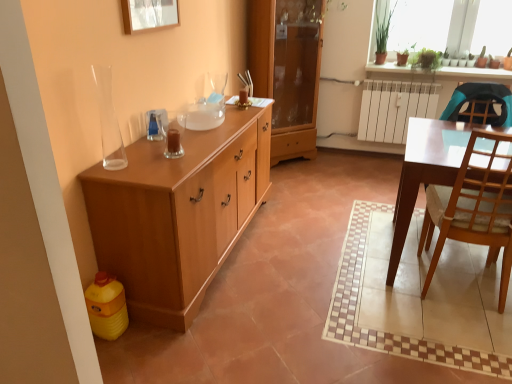
What do you see at coordinates (473, 208) in the screenshot? I see `light brown wooden chair at right` at bounding box center [473, 208].

I want to click on wooden cabinet at center, the 2th cabinetry in the front-to-back sequence, so click(287, 70).

Describe the element at coordinates (382, 30) in the screenshot. I see `green leafy plant at upper right, which appears as the 2th houseplant when viewed from the right` at that location.

Image resolution: width=512 pixels, height=384 pixels. In order to click on transparent glass vase at upper left in this screenshot , I will do `click(108, 120)`.

Which object is wider, green glass vase at upper right or wooden cabinet at center, the 2th cabinetry in the front-to-back sequence?

wooden cabinet at center, the 2th cabinetry in the front-to-back sequence, is wider.

Identify the location of the 1st cabinetry in front of the green glass vase at upper right. (287, 70).

From the image's perspective, who appears lower, green glass vase at upper right or wooden cabinet at center, the 2th cabinetry in the front-to-back sequence?

wooden cabinet at center, the 2th cabinetry in the front-to-back sequence, appears lower in the image.

Is the surface of light brown wooden chair at right in direct contact with light brown wood cabinet at left, positioned as the 2th cabinetry in back-to-front order?

They are not placed beside each other.

From a real-world perspective, is light brown wooden chair at right beneath light brown wood cabinet at left, positioned as the 2th cabinetry in back-to-front order?

No.

Consider the image. Is light brown wooden chair at right positioned with its back to light brown wood cabinet at left, positioned as the 2th cabinetry in back-to-front order?

No.

Is light brown wooden chair at right wider or thinner than light brown wood cabinet at left, which is the first cabinetry in front-to-back order?

Considering their sizes, light brown wooden chair at right looks broader than light brown wood cabinet at left, which is the first cabinetry in front-to-back order.

The width and height of the screenshot is (512, 384). Identify the location of counter top above the light brown wood cabinet at left, which is the first cabinetry in front-to-back order (from a real-world perspective). (473, 73).

Measure the distance from green glass vase at upper right to light brown wood cabinet at left, which is the first cabinetry in front-to-back order.

7.83 feet.

Visually, is green glass vase at upper right positioned to the left or to the right of light brown wood cabinet at left, which is the first cabinetry in front-to-back order?

green glass vase at upper right is to the right of light brown wood cabinet at left, which is the first cabinetry in front-to-back order.

Does green glass vase at upper right have a smaller size compared to light brown wood cabinet at left, which is the first cabinetry in front-to-back order?

Indeed, green glass vase at upper right has a smaller size compared to light brown wood cabinet at left, which is the first cabinetry in front-to-back order.

Is green leafy plant at upper right, which appears as the 2th houseplant when viewed from the right, thinner than light brown wood cabinet at left, which is the first cabinetry in front-to-back order?

Correct, the width of green leafy plant at upper right, which appears as the 2th houseplant when viewed from the right, is less than that of light brown wood cabinet at left, which is the first cabinetry in front-to-back order.

Are green leafy plant at upper right, the first houseplant when ordered from left to right, and light brown wood cabinet at left, positioned as the 2th cabinetry in back-to-front order, far apart?

That's right, there is a large distance between green leafy plant at upper right, the first houseplant when ordered from left to right, and light brown wood cabinet at left, positioned as the 2th cabinetry in back-to-front order.

Is green leafy plant at upper right, which appears as the 2th houseplant when viewed from the right, turned away from light brown wood cabinet at left, which is the first cabinetry in front-to-back order?

green leafy plant at upper right, which appears as the 2th houseplant when viewed from the right, is not turned away from light brown wood cabinet at left, which is the first cabinetry in front-to-back order.

From the image's perspective, who appears lower, light brown wood cabinet at left, positioned as the 2th cabinetry in back-to-front order, or green leafy plants at upper right?

light brown wood cabinet at left, positioned as the 2th cabinetry in back-to-front order, appears lower in the image.

Is light brown wood cabinet at left, which is the first cabinetry in front-to-back order, next to green leafy plants at upper right?

No, light brown wood cabinet at left, which is the first cabinetry in front-to-back order, is not in contact with green leafy plants at upper right.

Which is in front, point (158, 212) or point (379, 13)?

The point (158, 212) is closer to the camera.

From a real-world perspective, is transparent glass vase at upper left under green matte plant at upper right, the 1th houseplant from the right?

No, from a real-world perspective, transparent glass vase at upper left is not beneath green matte plant at upper right, the 1th houseplant from the right.

Is transparent glass vase at upper left outside of green matte plant at upper right, the 1th houseplant from the right?

Absolutely, transparent glass vase at upper left is external to green matte plant at upper right, the 1th houseplant from the right.

Between transparent glass vase at upper left and green matte plant at upper right, the 1th houseplant from the right, which one appears on the right side from the viewer's perspective?

green matte plant at upper right, the 1th houseplant from the right, is more to the right.

Based on the photo, is transparent glass vase at upper left turned away from green matte plant at upper right, the 1th houseplant from the right?

transparent glass vase at upper left does not have its back to green matte plant at upper right, the 1th houseplant from the right.

Where is `window screen above the green glass vase at upper right (from the image's perspective)`? window screen above the green glass vase at upper right (from the image's perspective) is located at coordinates (450, 25).

Which is more to the right, green glass vase at upper right or green leafy plants at upper right?

green leafy plants at upper right.

How different are the orientations of green glass vase at upper right and green leafy plants at upper right in degrees?

The angle between the facing direction of green glass vase at upper right and the facing direction of green leafy plants at upper right is 0.000216 degrees.

Which object is closer to the camera, green glass vase at upper right or green leafy plants at upper right?

green leafy plants at upper right is in front.

Where is `counter top lying above the wooden cabinet at center, positioned as the 1th cabinetry in back-to-front order (from the image's perspective)`? Image resolution: width=512 pixels, height=384 pixels. counter top lying above the wooden cabinet at center, positioned as the 1th cabinetry in back-to-front order (from the image's perspective) is located at coordinates (473, 73).

This screenshot has height=384, width=512. In the image, there is a light brown wooden chair at right. Find the location of `cabinetry below it (from a real-world perspective)`. cabinetry below it (from a real-world perspective) is located at coordinates (177, 213).

When comparing their distances from transparent glass sink at center, does green glass vase at upper right or green leafy plant at upper right, which appears as the 2th houseplant when viewed from the right, seem further?

green glass vase at upper right lies further to transparent glass sink at center than the other object.

When comparing their distances from green leafy plants at upper right, does green matte plant at upper right, positioned as the second houseplant in left-to-right order, or green glass vase at upper right seem closer?

green matte plant at upper right, positioned as the second houseplant in left-to-right order, is positioned closer to the anchor green leafy plants at upper right.

Estimate the real-world distances between objects in this image. Which object is further from light brown wood cabinet at left, positioned as the 2th cabinetry in back-to-front order, green leafy plants at upper right or transparent glass vase at upper left?

green leafy plants at upper right.

Estimate the real-world distances between objects in this image. Which object is further from green leafy plant at upper right, which appears as the 2th houseplant when viewed from the right, transparent glass sink at center or green matte plant at upper right, the 1th houseplant from the right?

transparent glass sink at center is further to green leafy plant at upper right, which appears as the 2th houseplant when viewed from the right.

Estimate the real-world distances between objects in this image. Which object is further from wooden cabinet at center, positioned as the 1th cabinetry in back-to-front order, transparent glass sink at center or light brown wooden chair at right?

light brown wooden chair at right is positioned further to the anchor wooden cabinet at center, positioned as the 1th cabinetry in back-to-front order.

Estimate the real-world distances between objects in this image. Which object is further from green glass vase at upper right, transparent glass vase at upper left or green leafy plants at upper right?

The object further to green glass vase at upper right is transparent glass vase at upper left.

Considering their positions, is transparent glass vase at upper left positioned closer to light brown wood cabinet at left, which is the first cabinetry in front-to-back order, than green glass vase at upper right?

transparent glass vase at upper left lies closer to light brown wood cabinet at left, which is the first cabinetry in front-to-back order, than the other object.

When comparing their distances from wooden cabinet at center, positioned as the 1th cabinetry in back-to-front order, does light brown wooden chair at right or light brown wood cabinet at left, which is the first cabinetry in front-to-back order, seem closer?

Based on the image, light brown wood cabinet at left, which is the first cabinetry in front-to-back order, appears to be nearer to wooden cabinet at center, positioned as the 1th cabinetry in back-to-front order.

You are a GUI agent. You are given a task and a screenshot of the screen. Output one action in this format:
    pyautogui.click(x=<x>, y=<y>)
    Task: Click on the window screen located between light brown wooden chair at right and green glass vase at upper right in the depth direction
    
    Given the screenshot: What is the action you would take?
    pyautogui.click(x=450, y=25)

Locate an element on the screen. This screenshot has height=384, width=512. sink situated between transparent glass vase at upper left and green leafy plant at upper right, which appears as the 2th houseplant when viewed from the right, from left to right is located at coordinates (206, 107).

Where is `counter top positioned between light brown wood cabinet at left, positioned as the 2th cabinetry in back-to-front order, and green leafy plant at upper right, the first houseplant when ordered from left to right, from near to far`? This screenshot has width=512, height=384. counter top positioned between light brown wood cabinet at left, positioned as the 2th cabinetry in back-to-front order, and green leafy plant at upper right, the first houseplant when ordered from left to right, from near to far is located at coordinates (473, 73).

You are a GUI agent. You are given a task and a screenshot of the screen. Output one action in this format:
    pyautogui.click(x=<x>, y=<y>)
    Task: Click on the sink between transparent glass vase at upper left and green matte plant at upper right, the 1th houseplant from the right
    This screenshot has width=512, height=384.
    Given the screenshot: What is the action you would take?
    pyautogui.click(x=206, y=107)